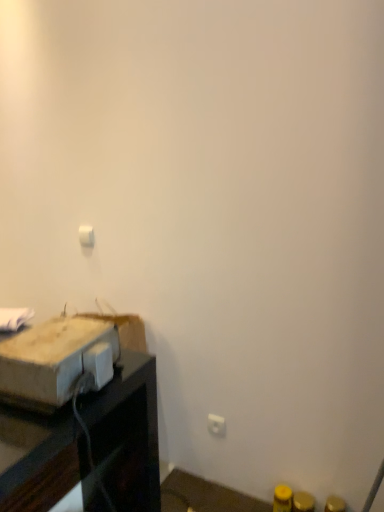
Question: Is white plastic light switch at upper center a part of brown cardboard box at left?

Choices:
 (A) no
 (B) yes

Answer: (A)

Question: Considering the relative sizes of brown cardboard box at left and white plastic light switch at upper center in the image provided, is brown cardboard box at left thinner than white plastic light switch at upper center?

Choices:
 (A) no
 (B) yes

Answer: (A)

Question: Is brown cardboard box at left smaller than white plastic light switch at upper center?

Choices:
 (A) no
 (B) yes

Answer: (A)

Question: From the image's perspective, is brown cardboard box at left over white plastic light switch at upper center?

Choices:
 (A) no
 (B) yes

Answer: (A)

Question: From the image's perspective, is brown cardboard box at left beneath white plastic light switch at upper center?

Choices:
 (A) yes
 (B) no

Answer: (A)

Question: From a real-world perspective, is white plastic electric outlet at lower right physically located above or below white plastic light switch at upper center?

Choices:
 (A) below
 (B) above

Answer: (A)

Question: Is point (218, 419) positioned closer to the camera than point (89, 245)?

Choices:
 (A) closer
 (B) farther

Answer: (A)

Question: Which is correct: white plastic electric outlet at lower right is inside white plastic light switch at upper center, or outside of it?

Choices:
 (A) outside
 (B) inside

Answer: (A)

Question: Considering their positions, is white plastic electric outlet at lower right located in front of or behind white plastic light switch at upper center?

Choices:
 (A) behind
 (B) front

Answer: (B)

Question: In the image, is brown cardboard box at left positioned in front of or behind white plastic electric outlet at lower right?

Choices:
 (A) front
 (B) behind

Answer: (A)

Question: From a real-world perspective, is brown cardboard box at left positioned above or below white plastic electric outlet at lower right?

Choices:
 (A) above
 (B) below

Answer: (A)

Question: Looking at their shapes, would you say brown cardboard box at left is wider or thinner than white plastic electric outlet at lower right?

Choices:
 (A) thin
 (B) wide

Answer: (B)

Question: Is brown cardboard box at left situated inside white plastic electric outlet at lower right or outside?

Choices:
 (A) outside
 (B) inside

Answer: (A)

Question: Visually, is white plastic electric outlet at lower right positioned to the left or to the right of brown cardboard box at left?

Choices:
 (A) right
 (B) left

Answer: (A)

Question: Is point (223, 431) positioned closer to the camera than point (9, 365)?

Choices:
 (A) closer
 (B) farther

Answer: (B)